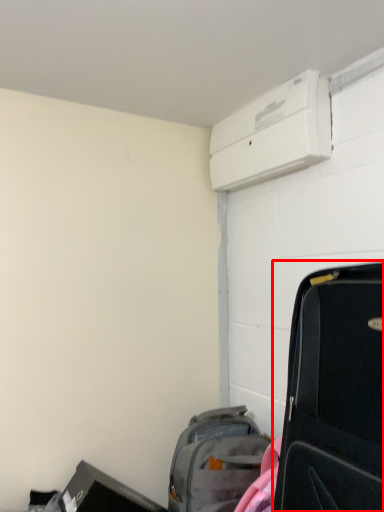
Question: From the image's perspective, what is the correct spatial relationship of suitcase (annotated by the red box) in relation to luggage and bags?

Choices:
 (A) above
 (B) below

Answer: (A)